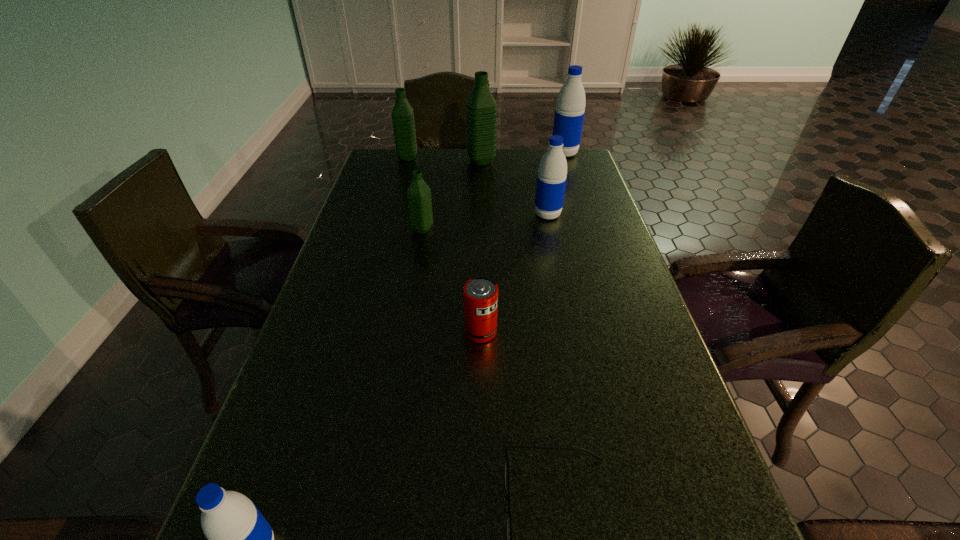
You are a GUI agent. You are given a task and a screenshot of the screen. Output one action in this format:
    pyautogui.click(x=<x>, y=<y>)
    Task: Click on the object that ranks as the fifth closest to the biggest green water bottle
    
    Given the screenshot: What is the action you would take?
    pyautogui.click(x=480, y=294)

Identify which water bottle is the second closest to the leftmost blue water bottle. Please provide its 2D coordinates. Your answer should be formatted as a tuple, i.e. [(x, y)], where the tuple contains the x and y coordinates of a point satisfying the conditions above.

[(552, 174)]

Select which water bottle is the second closest to the second shortest object. Please provide its 2D coordinates. Your answer should be formatted as a tuple, i.e. [(x, y)], where the tuple contains the x and y coordinates of a point satisfying the conditions above.

[(552, 174)]

You are a GUI agent. You are given a task and a screenshot of the screen. Output one action in this format:
    pyautogui.click(x=<x>, y=<y>)
    Task: Click on the blue water bottle that is the second closest to the second shortest object
    Image resolution: width=960 pixels, height=540 pixels.
    Given the screenshot: What is the action you would take?
    pyautogui.click(x=240, y=539)

Locate an element on the screen. blue water bottle object that ranks as the second closest to the rightmost green water bottle is located at coordinates (552, 174).

Where is `green water bottle that is the second closest to the sixth farthest object`? The height and width of the screenshot is (540, 960). green water bottle that is the second closest to the sixth farthest object is located at coordinates (481, 109).

In order to click on green water bottle identified as the closest to the biggest green water bottle in this screenshot , I will do `click(403, 121)`.

Where is `vacant space that satisfies the following two spatial constraints: 1. on the front side of the second green water bottle from left to right; 2. on the left side of the second smallest green water bottle`? The width and height of the screenshot is (960, 540). vacant space that satisfies the following two spatial constraints: 1. on the front side of the second green water bottle from left to right; 2. on the left side of the second smallest green water bottle is located at coordinates (388, 230).

This screenshot has height=540, width=960. Find the location of `free spot that satisfies the following two spatial constraints: 1. on the front side of the third object from left to right; 2. on the left side of the second biggest green water bottle`. free spot that satisfies the following two spatial constraints: 1. on the front side of the third object from left to right; 2. on the left side of the second biggest green water bottle is located at coordinates (388, 230).